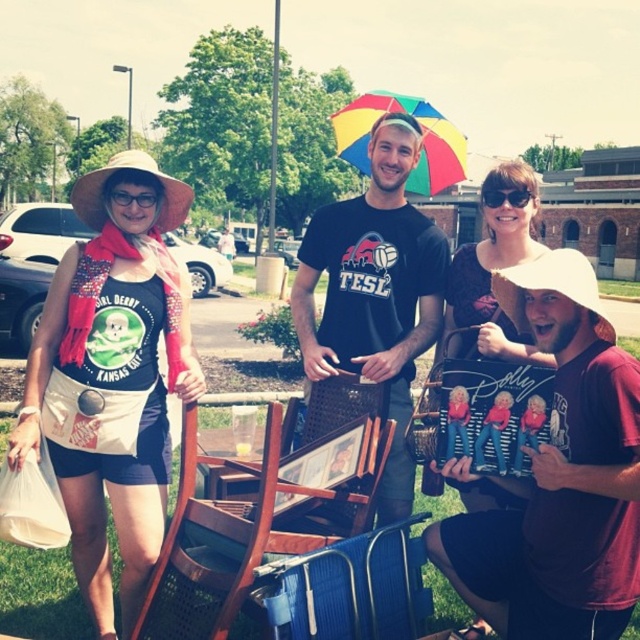
Does wooden chair at center have a greater height compared to black plastic goggles at upper center?

Yes.

Can you confirm if wooden chair at center is positioned below black plastic goggles at upper center?

Yes.

What do you see at coordinates (209, 545) in the screenshot? The width and height of the screenshot is (640, 640). I see `wooden chair at center` at bounding box center [209, 545].

Where is `wooden chair at center`? This screenshot has width=640, height=640. wooden chair at center is located at coordinates (209, 545).

Is point (400, 269) positioned in front of point (512, 333)?

No, it is not.

Is black cotton t-shirt at center above matte black shirt at center?

No.

Is point (428, 296) more distant than point (506, 172)?

Yes.

Where is `black cotton t-shirt at center`? black cotton t-shirt at center is located at coordinates (376, 291).

Locate an element on the screen. black cotton t-shirt at center is located at coordinates (376, 291).

Does point (324, 365) lie in front of point (112, 189)?

No.

What do you see at coordinates (376, 291) in the screenshot?
I see `black cotton t-shirt at center` at bounding box center [376, 291].

The image size is (640, 640). I want to click on black cotton t-shirt at center, so click(x=376, y=291).